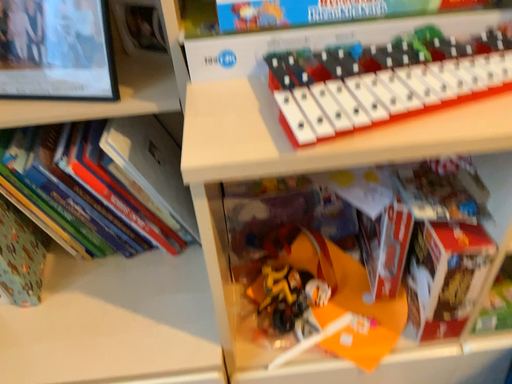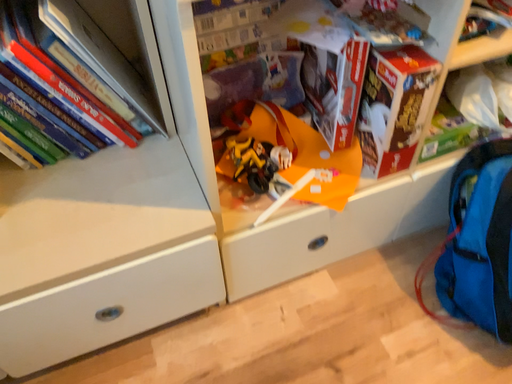
Question: Which way did the camera rotate in the video?

Choices:
 (A) rotated right
 (B) rotated left

Answer: (A)